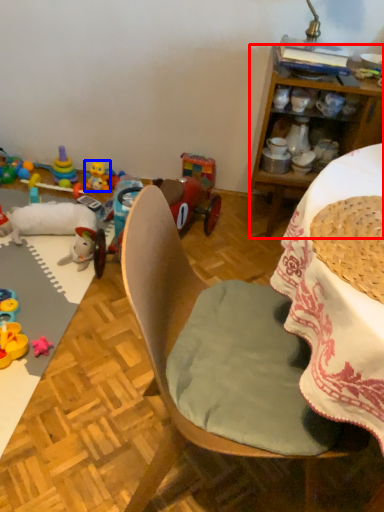
Question: Which of the following is the closest to the observer, cabinetry (highlighted by a red box) or toy (highlighted by a blue box)?

Choices:
 (A) cabinetry
 (B) toy

Answer: (A)